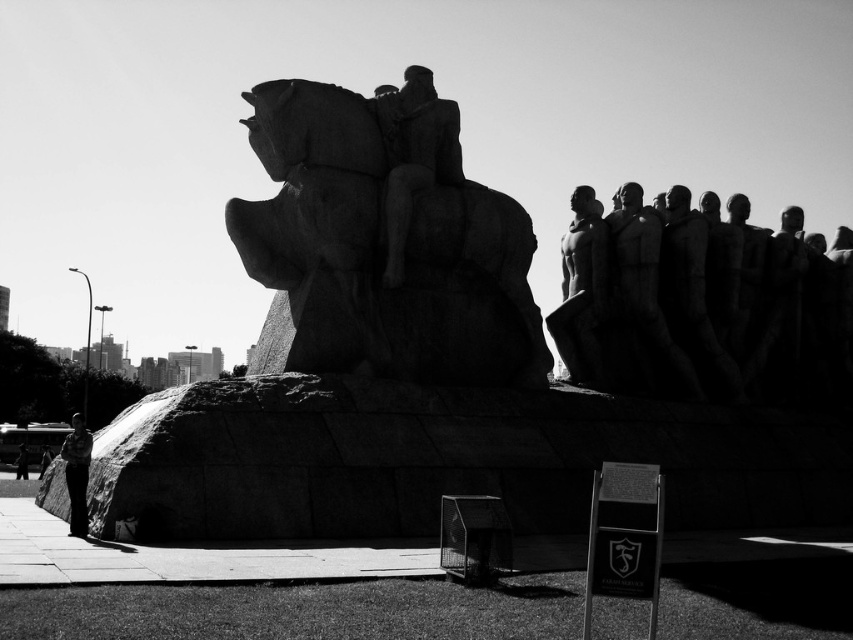
Question: Is camouflage shirt at lower left to the right of dark skin human at lower left from the viewer's perspective?

Choices:
 (A) no
 (B) yes

Answer: (B)

Question: Is smooth stone figures at center behind dark skin human at lower left?

Choices:
 (A) no
 (B) yes

Answer: (A)

Question: Is granite statue at center bigger than dark skin human at lower left?

Choices:
 (A) yes
 (B) no

Answer: (A)

Question: Which object is closer to the camera taking this photo?

Choices:
 (A) granite statue at center
 (B) smooth stone figures at center
 (C) dark skin human at lower left
 (D) smooth stone statue at center

Answer: (A)

Question: Which of these objects is positioned farthest from the smooth stone figures at center?

Choices:
 (A) smooth stone statue at center
 (B) granite statue at center
 (C) camouflage shirt at lower left

Answer: (C)

Question: Which point appears closest to the camera in this image?

Choices:
 (A) (410, 179)
 (B) (86, 445)

Answer: (B)